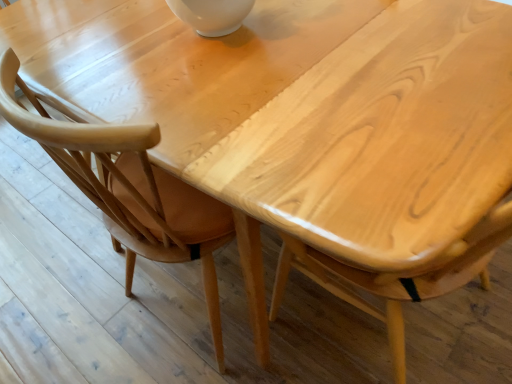
Locate an element on the screen. This screenshot has width=512, height=384. free space to the left of light brown wood chair at center is located at coordinates [x=81, y=306].